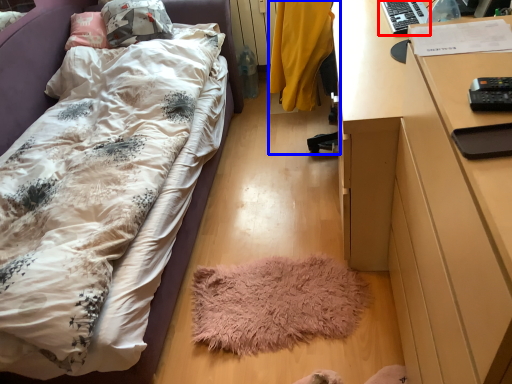
Question: Among these objects, which one is nearest to the camera, desktop (highlighted by a red box) or chair (highlighted by a blue box)?

Choices:
 (A) desktop
 (B) chair

Answer: (B)